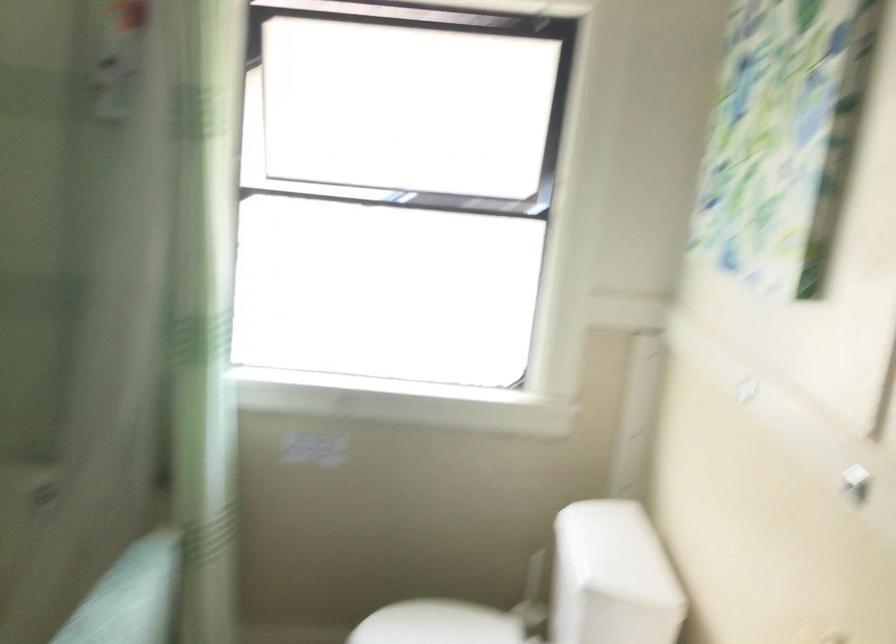
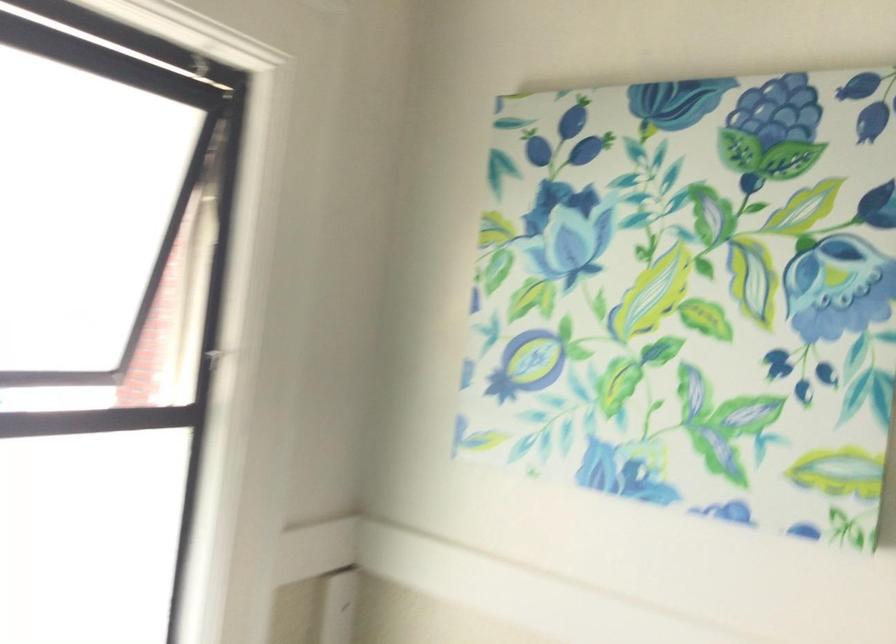
The point at (768, 129) is marked in the first image. Where is the corresponding point in the second image?

(693, 292)